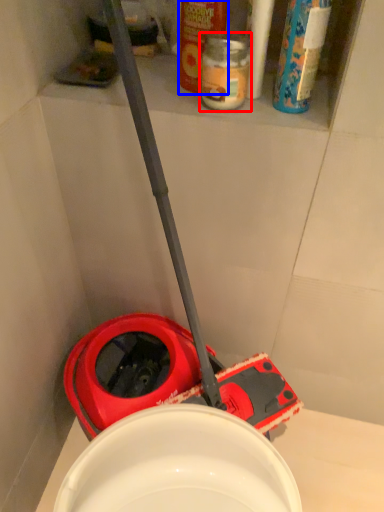
Question: Which object is further to the camera taking this photo, bottle (highlighted by a red box) or cleaning product (highlighted by a blue box)?

Choices:
 (A) bottle
 (B) cleaning product

Answer: (A)